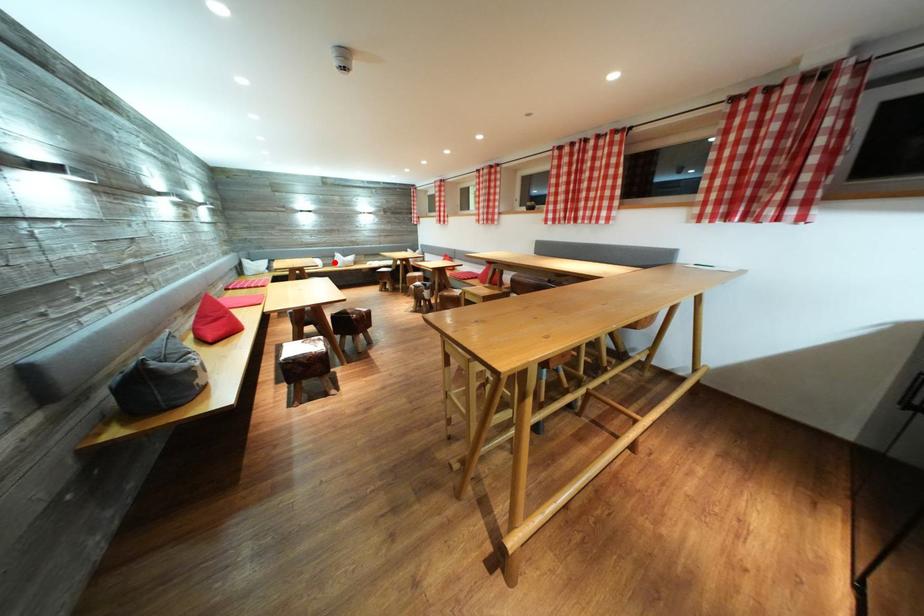
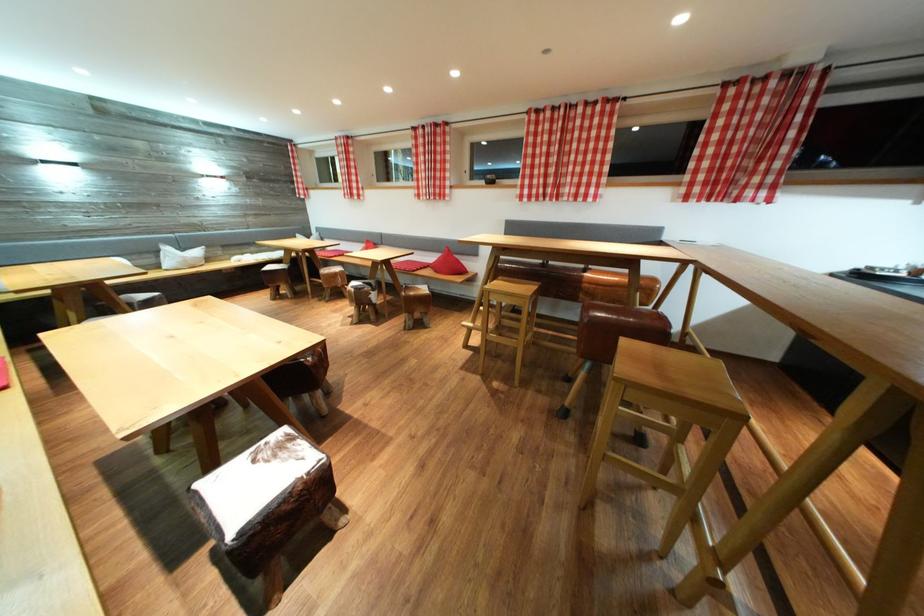
Question: I am providing you with two images of the same scene from different viewpoints. A red point is marked on the first image. At the location where the point appears in image 1, is it still visible in image 2?

Choices:
 (A) Yes
 (B) No

Answer: (A)